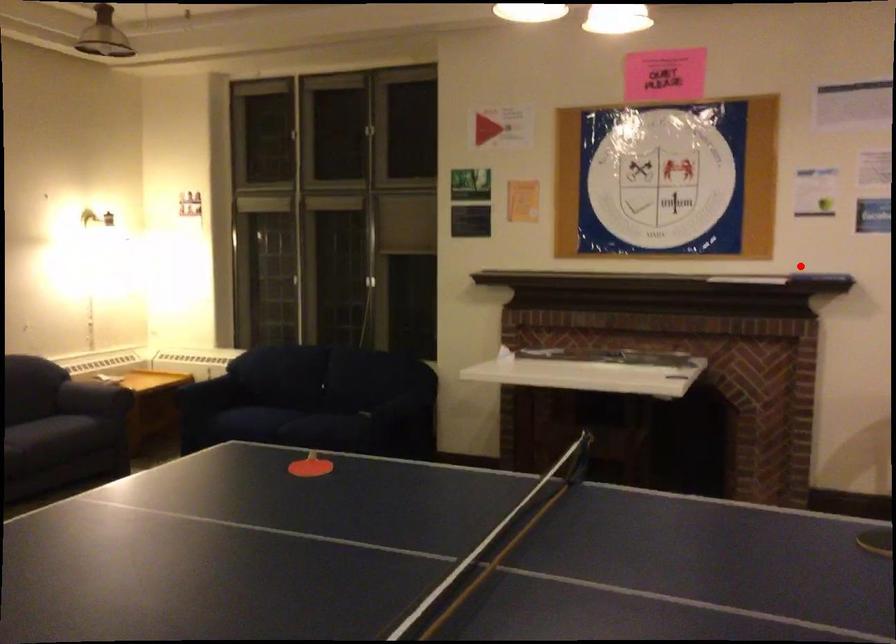
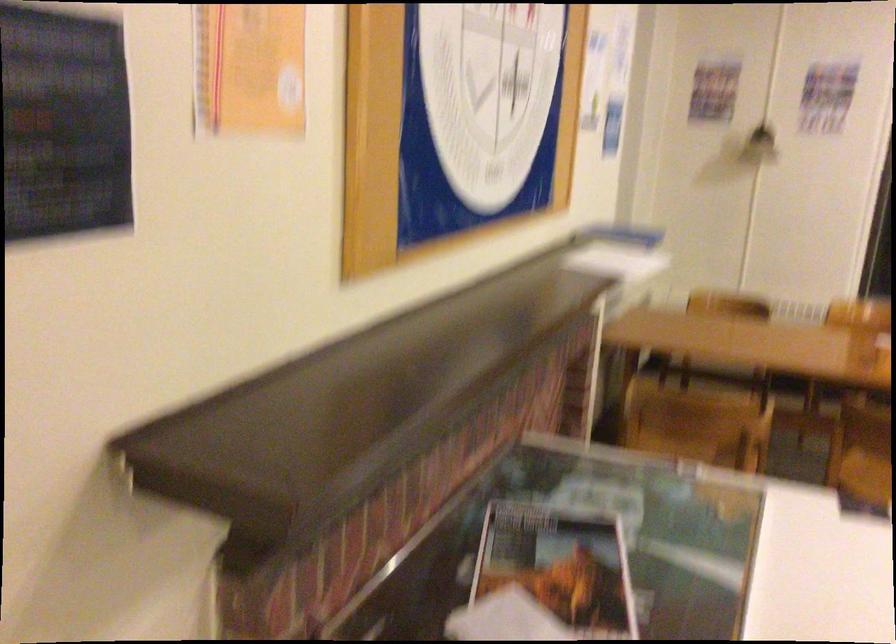
Locate, in the second image, the point that corresponds to the highlighted location in the first image.

(617, 252)